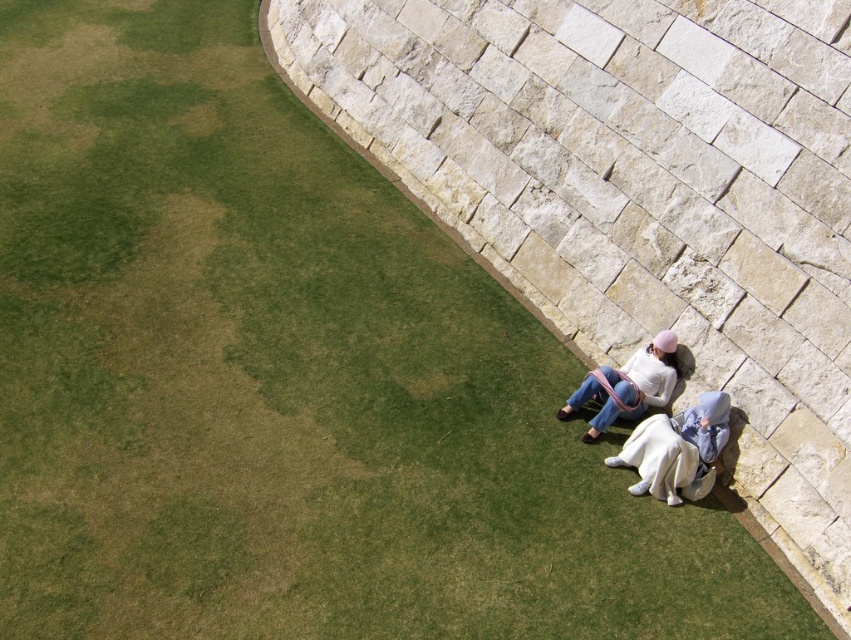
You are standing at a distance and want to hand a water bottle to the person wearing the white cotton dress at lower right. Based on the distance provided, can you estimate whether you can comfortably reach them without moving closer?

The white cotton dress at lower right is 10.55 meters away from the viewer. At this distance, it would be difficult to comfortably reach them without moving closer, as typical arm reach is much shorter than 10.55 meters.

You are a photographer trying to capture a photo of the two people sitting next to the curved stone wall. You want to ensure both the white cotton dress at lower right and the white cotton sweater at lower right are visible in the frame. Which one should you position closer to the center of the image to make sure both are fully visible?

You should position the white cotton sweater at lower right closer to the center of the image because the white cotton dress at lower right is on its right side, so centering the sweater allows both to be included without cropping either.

Based on the photo, you are a photographer planning to take a photo of the two people sitting next to the curved stone wall. You want to ensure the white cotton dress at lower right and the white cotton sweater at lower right are both visible in the frame. Since the dress is shorter, will you need to adjust your camera angle to include the entire sweater?

The white cotton dress at lower right is shorter than the white cotton sweater at lower right. To ensure the entire sweater is visible, you may need to adjust your camera angle to account for its longer length.